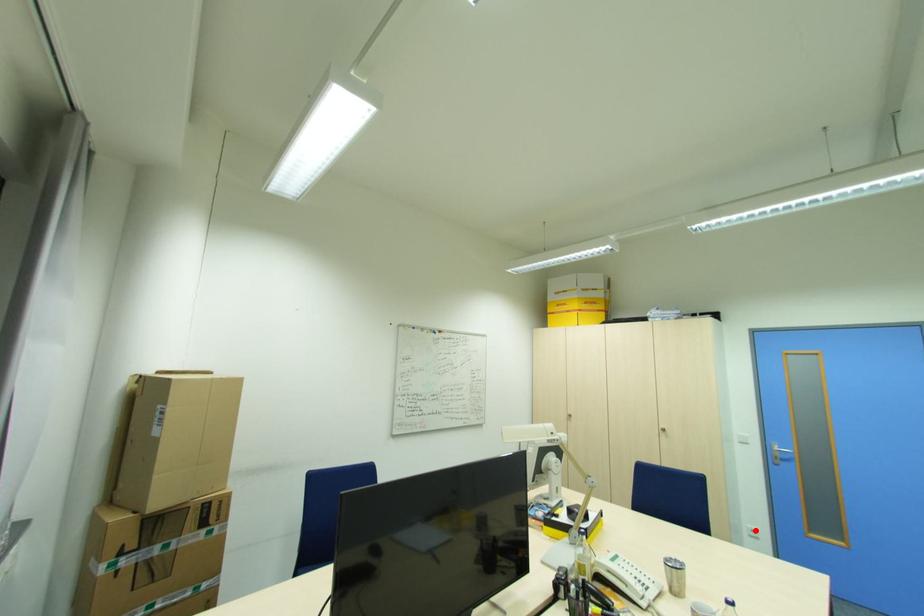
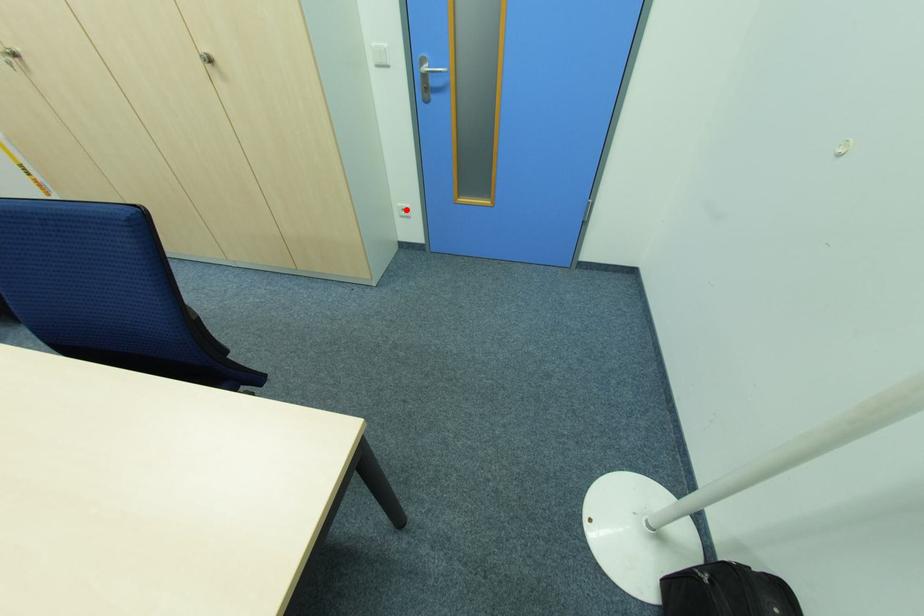
I am providing you with two images of the same scene from different viewpoints. A red point is marked on the first image and another point is marked on the second image. Are the points marked in image1 and image2 representing the same 3D position?

Yes